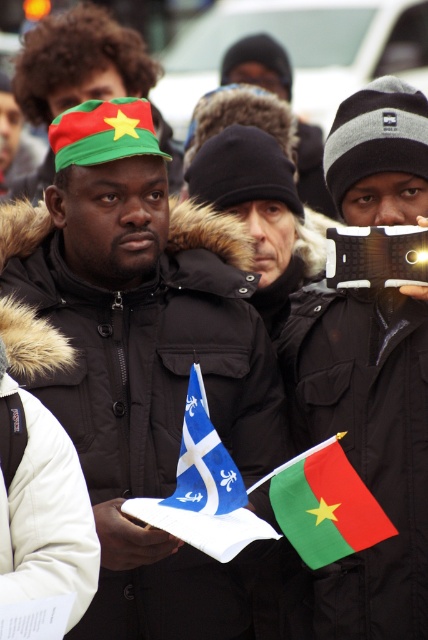
You are a photographer trying to capture a photo of the green matte flag at center and the black knit hat at center. Which object should you focus on first if you want to ensure both are in focus without adjusting the camera settings?

The green matte flag at center is much taller than the black knit hat at center, so focusing on the taller green matte flag at center first would help ensure both are in focus since it is further away.

You are a photographer trying to capture the central figure in the matte black jacket at center without any obstructions. Given the blue fabric flag at center is behind the jacket, will the flag be visible in your photo?

The blue fabric flag at center is behind the matte black jacket at center, so it will not be visible in the photo as the jacket is in front of it.